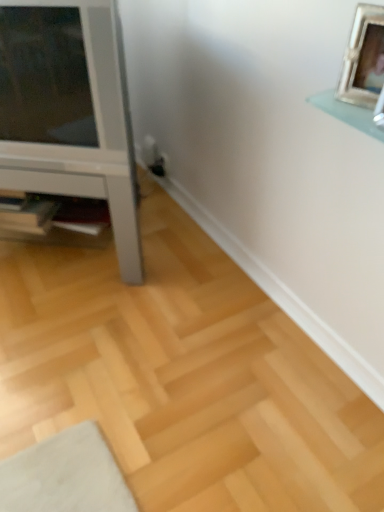
Question: Based on their positions, is wooden shelf at lower left located to the left or right of white glossy tv stand at left?

Choices:
 (A) right
 (B) left

Answer: (A)

Question: Considering the positions of wooden shelf at lower left and white glossy tv stand at left in the image, is wooden shelf at lower left bigger or smaller than white glossy tv stand at left?

Choices:
 (A) small
 (B) big

Answer: (A)

Question: Considering the real-world distances, which object is closest to the white glossy tv stand at left?

Choices:
 (A) wooden shelf at lower left
 (B) silver metallic picture frame at upper right

Answer: (A)

Question: Which object is positioned farthest from the wooden shelf at lower left?

Choices:
 (A) white glossy tv stand at left
 (B) silver metallic picture frame at upper right

Answer: (B)